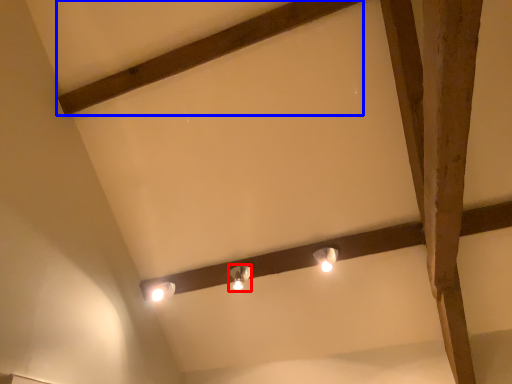
Question: Which object appears closest to the camera in this image, lamp (highlighted by a red box) or plank (highlighted by a blue box)?

Choices:
 (A) lamp
 (B) plank

Answer: (B)